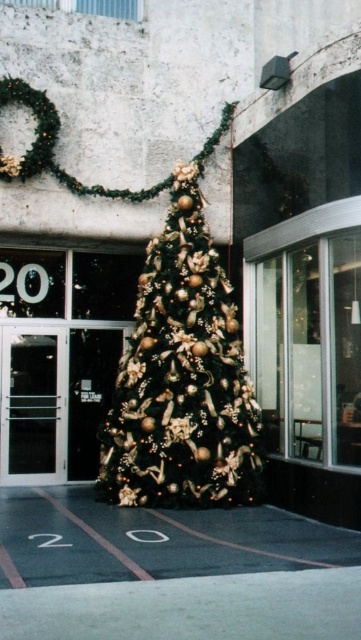
Question: In this image, where is shiny gold christmas tree at center located relative to transparent glass door at left?

Choices:
 (A) above
 (B) below

Answer: (A)

Question: Which point appears farthest from the camera in this image?

Choices:
 (A) pos(57,371)
 (B) pos(189,472)

Answer: (A)

Question: Can you confirm if shiny gold christmas tree at center is smaller than transparent glass door at left?

Choices:
 (A) no
 (B) yes

Answer: (A)

Question: In this image, where is shiny gold christmas tree at center located relative to transparent glass door at left?

Choices:
 (A) below
 (B) above

Answer: (B)

Question: Which point is closer to the camera?

Choices:
 (A) transparent glass door at left
 (B) shiny gold christmas tree at center

Answer: (B)